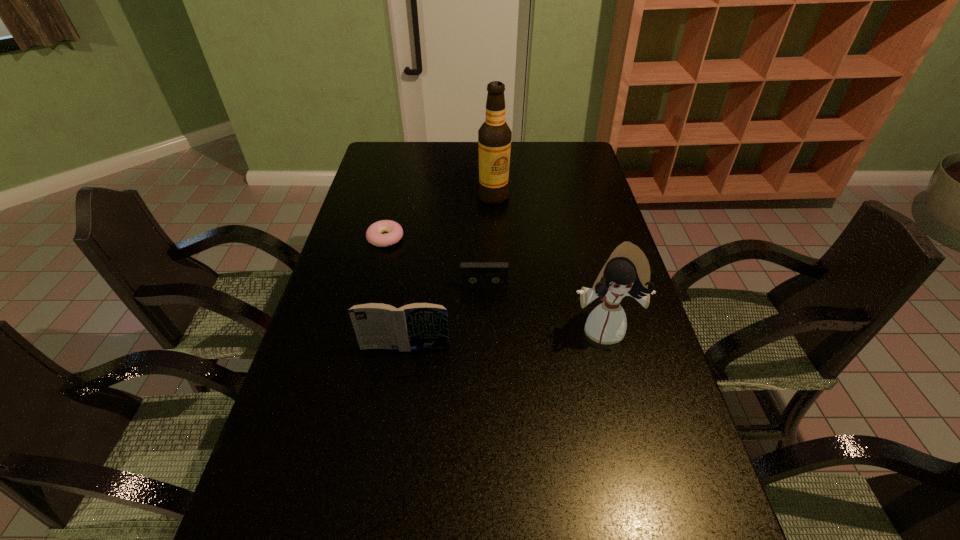
Where is `the tallest object`? the tallest object is located at coordinates (494, 136).

At what (x,y) coordinates should I click in order to perform the action: click on the farthest object. Please return your answer as a coordinate pair (x, y). The width and height of the screenshot is (960, 540). Looking at the image, I should click on (494, 136).

This screenshot has height=540, width=960. Find the location of `the fourth shortest object`. the fourth shortest object is located at coordinates (627, 272).

What are the coordinates of `the rightmost object` in the screenshot? It's located at (627, 272).

Locate an element on the screen. The image size is (960, 540). the third tallest object is located at coordinates (414, 326).

The width and height of the screenshot is (960, 540). What are the coordinates of `videotape` in the screenshot? It's located at (473, 274).

The width and height of the screenshot is (960, 540). Identify the location of the third farthest object. (473, 274).

Find the location of a particular element. the shortest object is located at coordinates (393, 231).

Identify the location of the second farthest object. The height and width of the screenshot is (540, 960). (393, 231).

At what (x,y) coordinates should I click in order to perform the action: click on vacant space located 0.390m on the label of the farthest object. Please return your answer as a coordinate pair (x, y). This screenshot has width=960, height=540. Looking at the image, I should click on (496, 282).